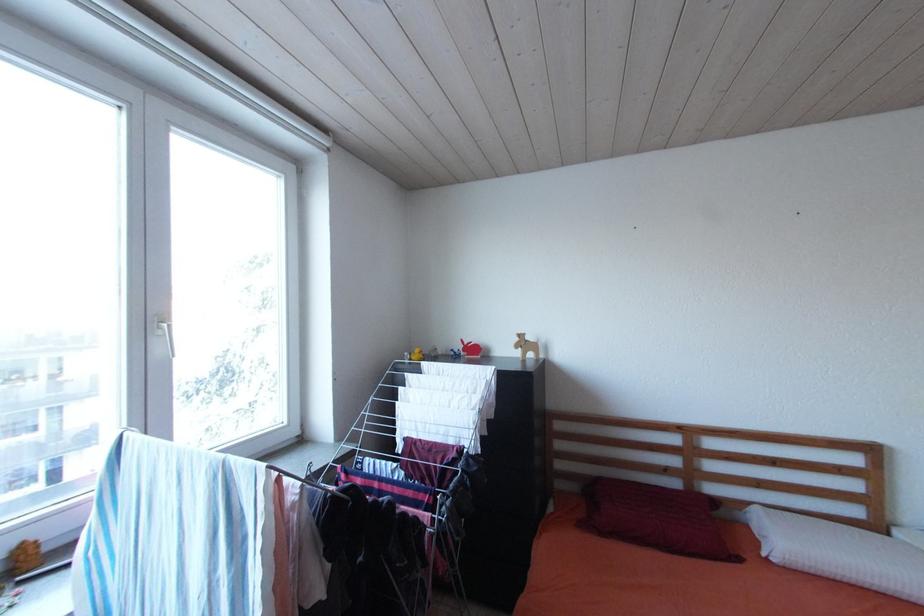
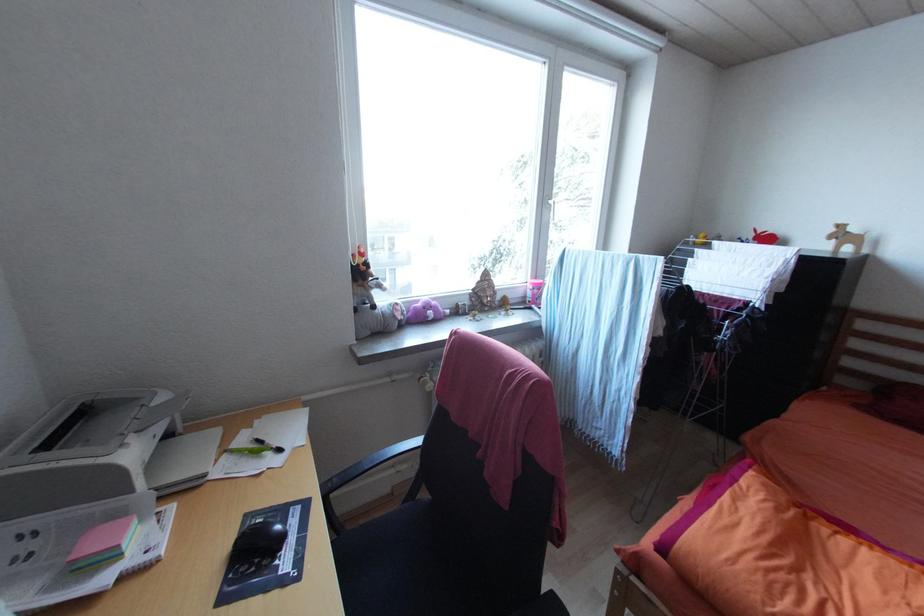
The first image is from the beginning of the video and the second image is from the end. How did the camera likely rotate when shooting the video?

The rotation direction of the camera is left-down.